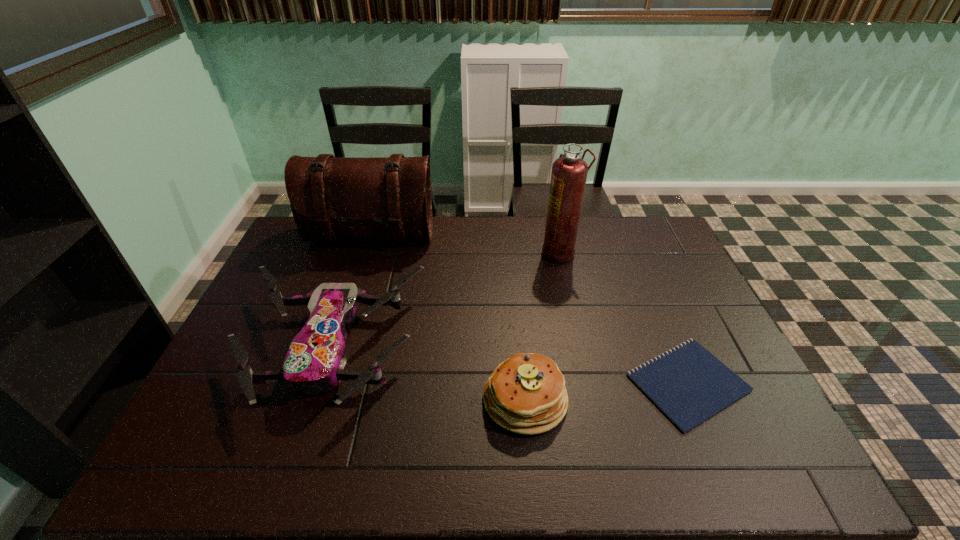
Find the location of a particular element. The image size is (960, 540). vacant area located 0.360m on the back of the pancake is located at coordinates click(x=515, y=278).

The image size is (960, 540). Find the location of `vacant area situated on the left of the rightmost object`. vacant area situated on the left of the rightmost object is located at coordinates 586,383.

At what (x,y) coordinates should I click in order to perform the action: click on fire extinguisher at the far edge. Please return your answer as a coordinate pair (x, y). This screenshot has width=960, height=540. Looking at the image, I should click on (569, 173).

Find the location of `satchel that is positioned at the far edge`. satchel that is positioned at the far edge is located at coordinates (332, 198).

What are the coordinates of `satchel present at the left edge` in the screenshot? It's located at (332, 198).

Identify the location of drone that is at the left edge. (314, 363).

You are a GUI agent. You are given a task and a screenshot of the screen. Output one action in this format:
    pyautogui.click(x=<x>, y=<y>)
    Task: Click on the object that is positioned at the right edge
    The height and width of the screenshot is (540, 960).
    Given the screenshot: What is the action you would take?
    pyautogui.click(x=688, y=384)

The height and width of the screenshot is (540, 960). Identify the location of object present at the far left corner. (332, 198).

The image size is (960, 540). I want to click on vacant region at the far edge of the desktop, so click(x=518, y=220).

You are a GUI agent. You are given a task and a screenshot of the screen. Output one action in this format:
    pyautogui.click(x=<x>, y=<y>)
    Task: Click on the free space at the near edge of the desktop
    Image resolution: width=960 pixels, height=540 pixels.
    Given the screenshot: What is the action you would take?
    pyautogui.click(x=618, y=471)